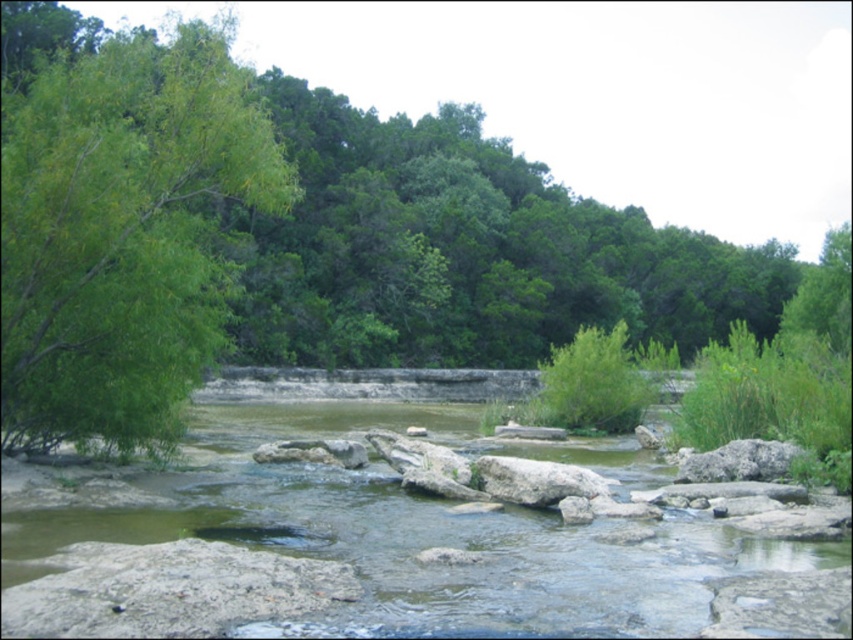
Does green stone river at center have a larger size compared to green leafy tree at left?

Actually, green stone river at center might be smaller than green leafy tree at left.

Locate an element on the screen. green stone river at center is located at coordinates (403, 529).

Who is more forward, (142, 499) or (79, 177)?

Point (79, 177)

Locate an element on the screen. green stone river at center is located at coordinates (403, 529).

Which is more to the right, green leafy tree at left or gray/rough rock at center?

From the viewer's perspective, gray/rough rock at center appears more on the right side.

Is green leafy tree at left wider than gray/rough rock at center?

Indeed, green leafy tree at left has a greater width compared to gray/rough rock at center.

Image resolution: width=853 pixels, height=640 pixels. Describe the element at coordinates (123, 232) in the screenshot. I see `green leafy tree at left` at that location.

Identify the location of green leafy tree at left. The height and width of the screenshot is (640, 853). (123, 232).

Between green stone river at center and gray/rough rock at center, which one is positioned lower?

Positioned lower is green stone river at center.

Does point (119, 616) come closer to viewer compared to point (492, 458)?

Yes, it is in front of point (492, 458).

Image resolution: width=853 pixels, height=640 pixels. What are the coordinates of `green stone river at center` in the screenshot? It's located at (403, 529).